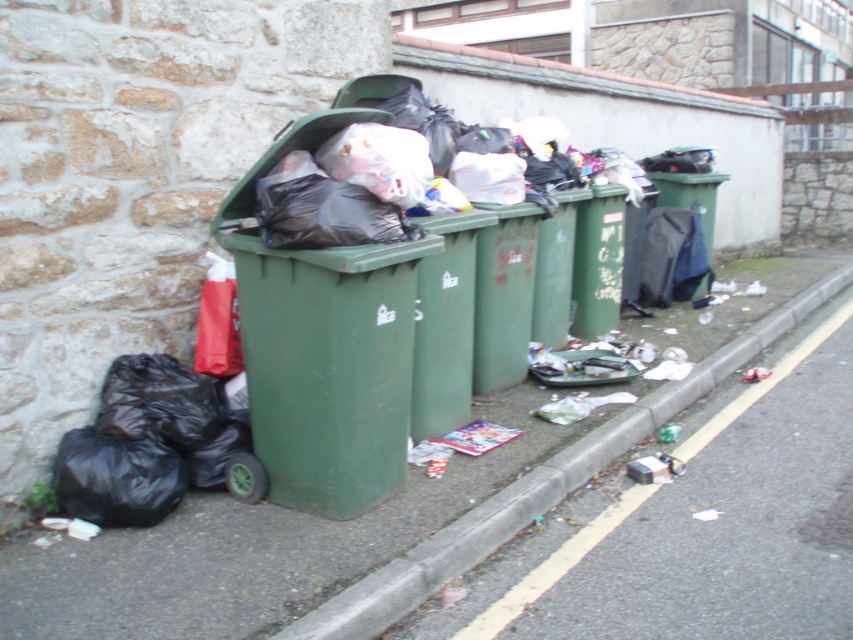
Is green plastic pavement at lower left to the right of green plastic bin at left from the viewer's perspective?

Yes, green plastic pavement at lower left is to the right of green plastic bin at left.

The height and width of the screenshot is (640, 853). What do you see at coordinates (251, 548) in the screenshot?
I see `green plastic pavement at lower left` at bounding box center [251, 548].

Does point (227, 536) come in front of point (267, 358)?

Yes, point (227, 536) is in front of point (267, 358).

Locate an element on the screen. The height and width of the screenshot is (640, 853). green plastic pavement at lower left is located at coordinates (251, 548).